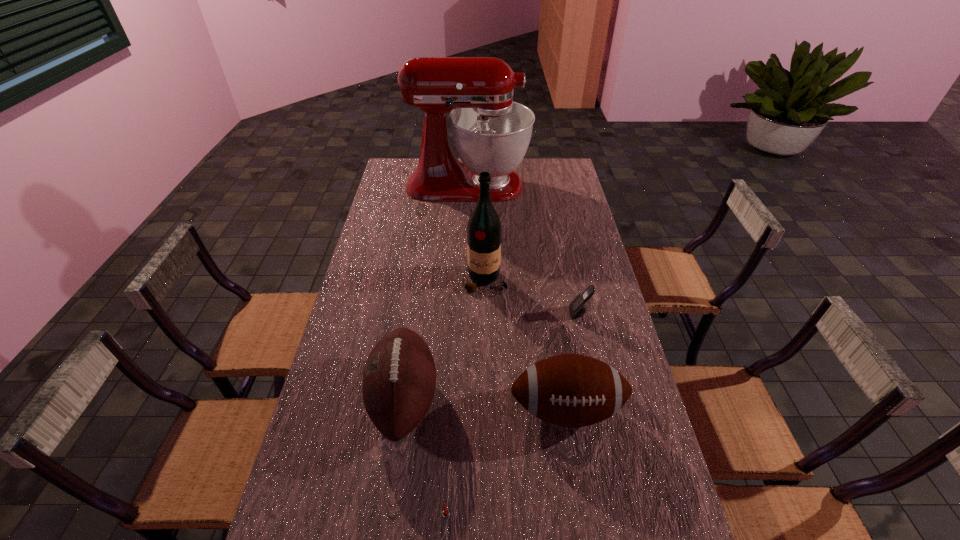
Locate an element on the screen. The height and width of the screenshot is (540, 960). mixer is located at coordinates (491, 133).

Where is `the tallest object`? The width and height of the screenshot is (960, 540). the tallest object is located at coordinates (491, 133).

I want to click on the second tallest object, so click(x=484, y=231).

The image size is (960, 540). I want to click on wine bottle, so click(x=484, y=231).

At what (x,y) coordinates should I click in order to perform the action: click on the left football. Please return your answer as a coordinate pair (x, y). Looking at the image, I should click on [399, 378].

At what (x,y) coordinates should I click in order to perform the action: click on the right football. Please return your answer as a coordinate pair (x, y). Image resolution: width=960 pixels, height=540 pixels. Looking at the image, I should click on (571, 390).

At what (x,y) coordinates should I click in order to perform the action: click on cellular telephone. Please return your answer as a coordinate pair (x, y). This screenshot has height=540, width=960. Looking at the image, I should click on (577, 308).

Locate an element on the screen. the fourth nearest object is located at coordinates (577, 308).

Find the location of a particular element. vacant space located at the attachment hub of the mixer is located at coordinates (567, 185).

Image resolution: width=960 pixels, height=540 pixels. I want to click on free point located 0.360m on the surface of the second farthest object, so click(488, 386).